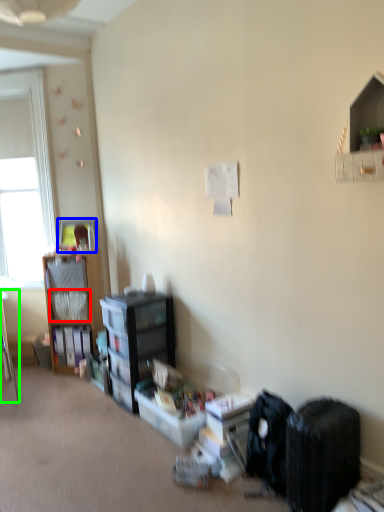
Question: Considering the real-world distances, which object is closest to shelf (highlighted by a red box)? picture frame (highlighted by a blue box) or desk (highlighted by a green box).

Choices:
 (A) picture frame
 (B) desk

Answer: (A)